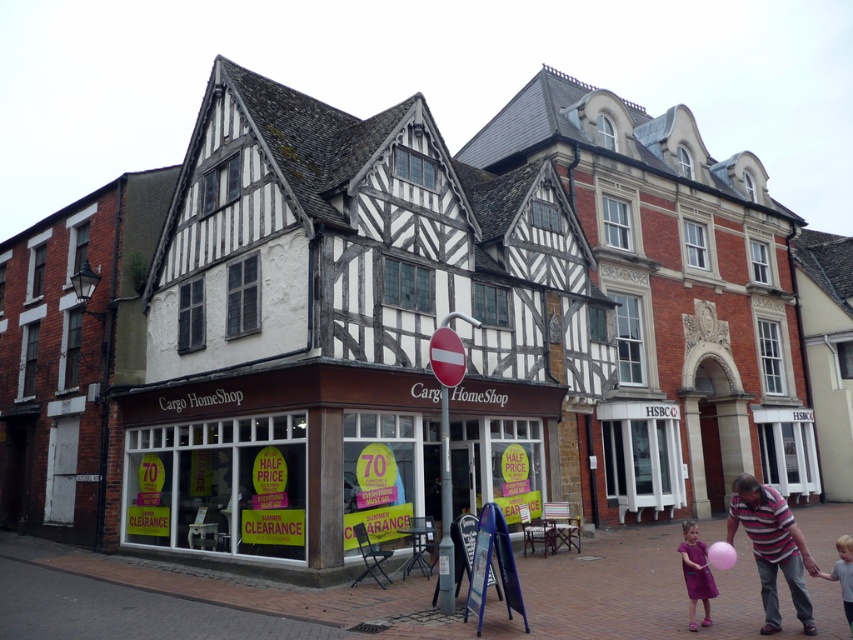
Which is more to the left, matte brown storefront at center or red plastic sign at center?

Positioned to the left is matte brown storefront at center.

Find the location of a particular element. matte brown storefront at center is located at coordinates (280, 461).

Who is more forward, (247, 381) or (453, 598)?

Point (453, 598) is more forward.

Identify the location of matte brown storefront at center. This screenshot has height=640, width=853. pyautogui.click(x=280, y=461).

Is red plastic sign at center bigger than light blue fabric shirt at lower right?

Actually, red plastic sign at center might be smaller than light blue fabric shirt at lower right.

Can you confirm if red plastic sign at center is wider than light blue fabric shirt at lower right?

Incorrect, red plastic sign at center's width does not surpass light blue fabric shirt at lower right's.

The height and width of the screenshot is (640, 853). I want to click on red plastic sign at center, so click(445, 442).

Locate an element on the screen. red plastic sign at center is located at coordinates (445, 442).

Is purple satin dress at lower right positioned at the back of light blue fabric shirt at lower right?

Yes, it is.

Identify the location of purple satin dress at lower right. The width and height of the screenshot is (853, 640). click(x=695, y=573).

Where is `purple satin dress at lower right`? This screenshot has height=640, width=853. purple satin dress at lower right is located at coordinates (695, 573).

Where is `purple satin dress at lower right`? The image size is (853, 640). purple satin dress at lower right is located at coordinates (695, 573).